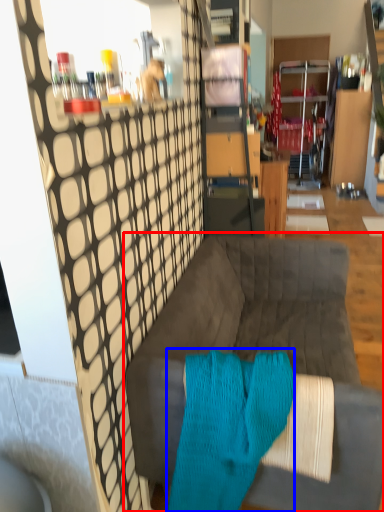
Question: Which point is further to the camera, studio couch (highlighted by a red box) or aqua (highlighted by a blue box)?

Choices:
 (A) studio couch
 (B) aqua

Answer: (A)